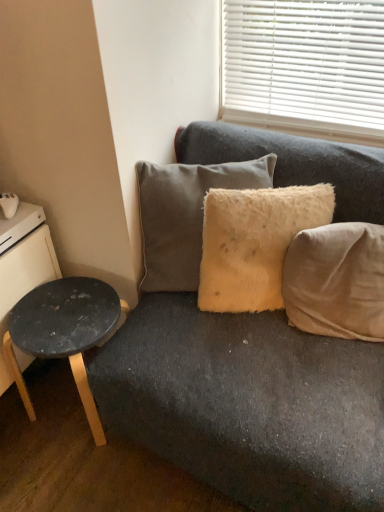
Question: Does point (44, 217) appear closer or farther from the camera than point (218, 259)?

Choices:
 (A) closer
 (B) farther

Answer: (B)

Question: Is white glossy drawer at left wider or thinner than fuzzy yellow pillow at center, marked as the 2th pillow in a left-to-right arrangement?

Choices:
 (A) wide
 (B) thin

Answer: (A)

Question: Based on their relative distances, which object is farther from the matte black stool at lower left?

Choices:
 (A) black wood dresser at left
 (B) beige fabric pillow at right, which is counted as the 1th pillow, starting from the right
 (C) fuzzy yellow pillow at center, marked as the 2th pillow in a left-to-right arrangement
 (D) white glossy drawer at left
 (E) fuzzy beige pillow at center, marked as the first pillow in a left-to-right arrangement

Answer: (B)

Question: Which object is the farthest from the beige fabric pillow at right, acting as the 3th pillow starting from the left?

Choices:
 (A) black wood dresser at left
 (B) fuzzy beige pillow at center, marked as the first pillow in a left-to-right arrangement
 (C) matte black stool at lower left
 (D) fuzzy yellow pillow at center, marked as the 2th pillow in a left-to-right arrangement
 (E) white glossy drawer at left

Answer: (E)